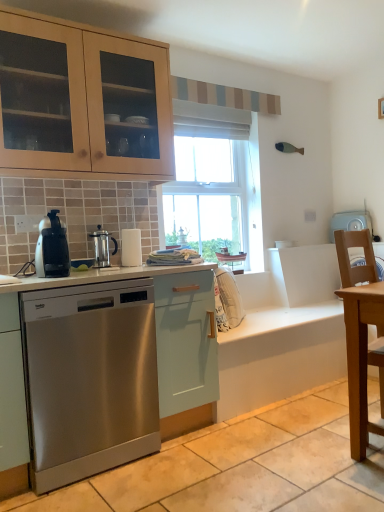
In order to click on unoccupied region to the right of satin black coffee maker at left in this screenshot , I will do `click(89, 274)`.